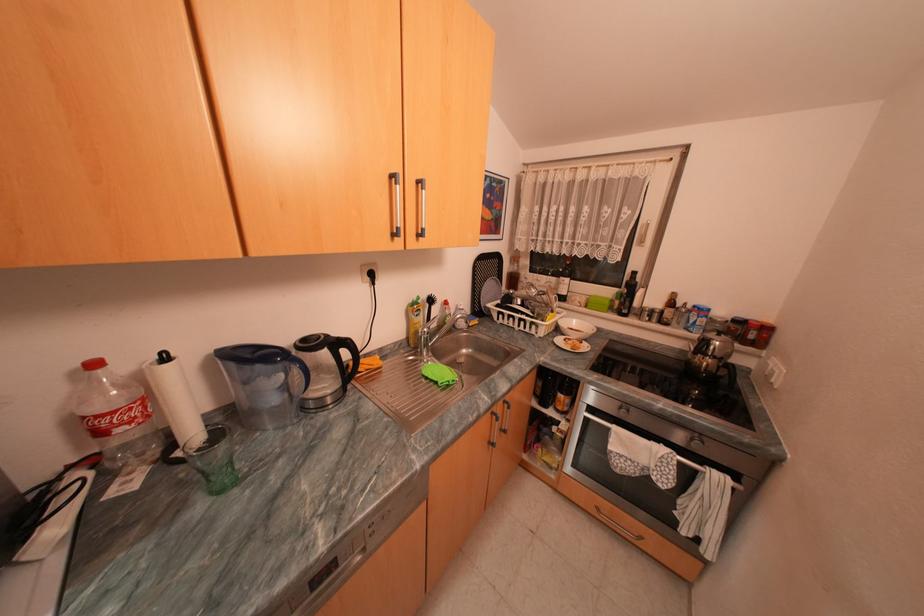
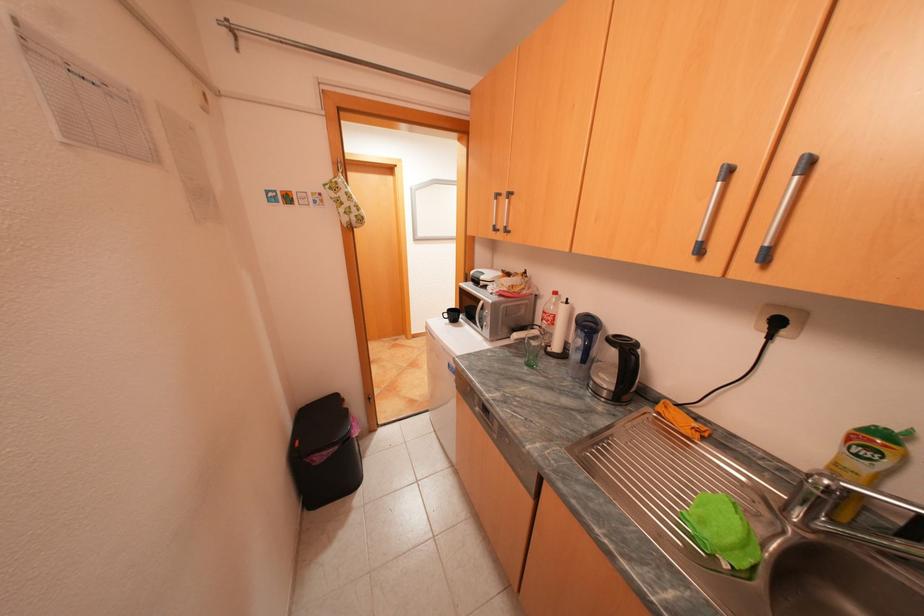
Where in the second image is the point corresponding to (x=108, y=416) from the first image?

(553, 312)